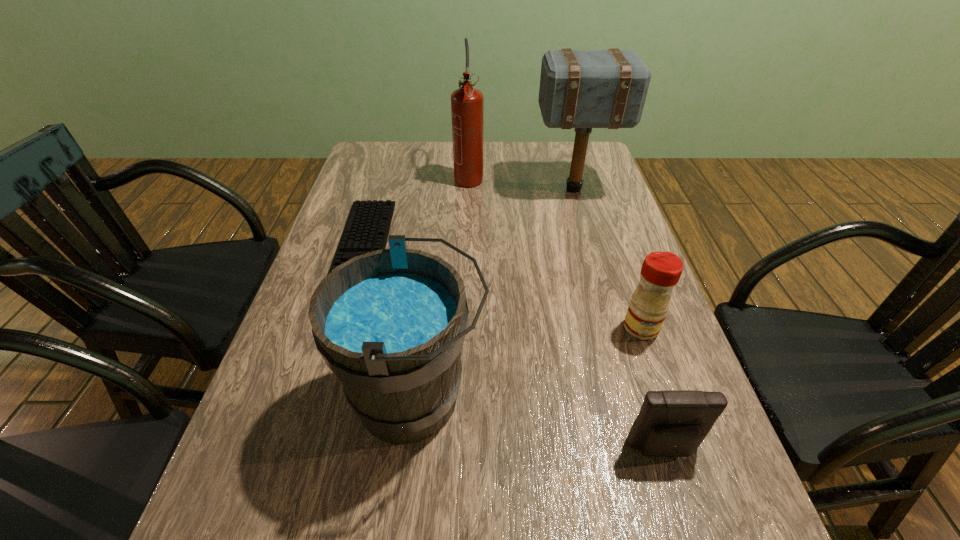
Find the location of `vacant point located between the condiment and the fourth shortest object`. vacant point located between the condiment and the fourth shortest object is located at coordinates (529, 363).

Where is `vacant point located between the wine bucket and the condiment`? Image resolution: width=960 pixels, height=540 pixels. vacant point located between the wine bucket and the condiment is located at coordinates (529, 363).

You are a GUI agent. You are given a task and a screenshot of the screen. Output one action in this format:
    pyautogui.click(x=<x>, y=<y>)
    Task: Click on the empty space between the third nearest object and the pouch
    The height and width of the screenshot is (540, 960).
    Given the screenshot: What is the action you would take?
    pyautogui.click(x=652, y=388)

At what (x,y) coordinates should I click in order to perform the action: click on free point between the third nearest object and the mallet. Please return your answer as a coordinate pair (x, y). Image resolution: width=960 pixels, height=540 pixels. Looking at the image, I should click on (608, 258).

Locate an element on the screen. The width and height of the screenshot is (960, 540). empty location between the fire extinguisher and the computer keyboard is located at coordinates (417, 210).

Find the location of a particular element. This screenshot has height=540, width=960. vacant space in between the pouch and the third tallest object is located at coordinates (540, 423).

What are the coordinates of `object that stands as the fourth closest to the fourth tallest object` in the screenshot? It's located at (367, 228).

This screenshot has width=960, height=540. What are the coordinates of `the second closest object to the pouch` in the screenshot? It's located at (390, 324).

Image resolution: width=960 pixels, height=540 pixels. In order to click on free space that satisfies the following two spatial constraints: 1. from the nozzle of the fire extinguisher; 2. with a handle on the side of the third tallest object in this screenshot , I will do `click(461, 398)`.

This screenshot has width=960, height=540. Find the location of `vacant space that satisfies the following two spatial constraints: 1. on the back side of the third shortest object; 2. on the striking surface of the mallet`. vacant space that satisfies the following two spatial constraints: 1. on the back side of the third shortest object; 2. on the striking surface of the mallet is located at coordinates (592, 189).